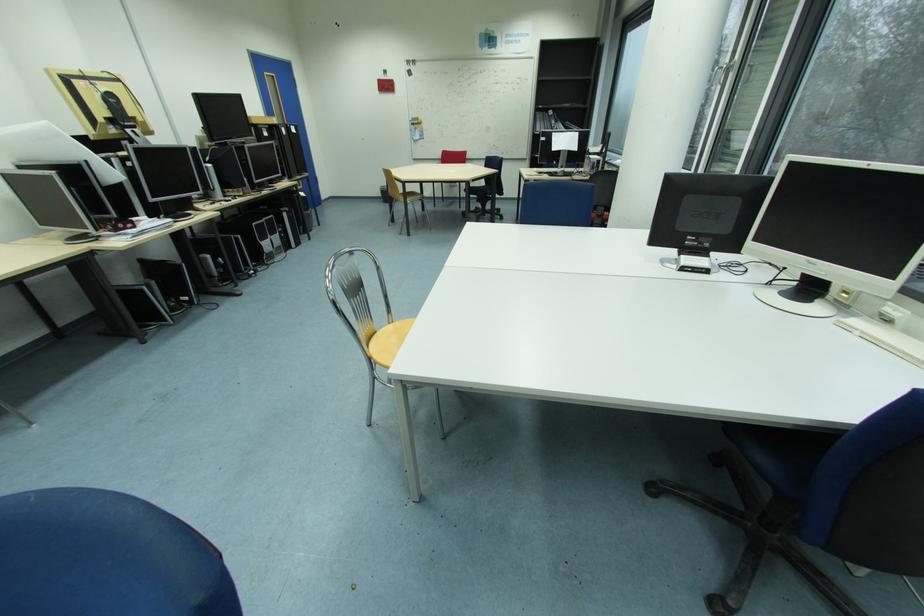
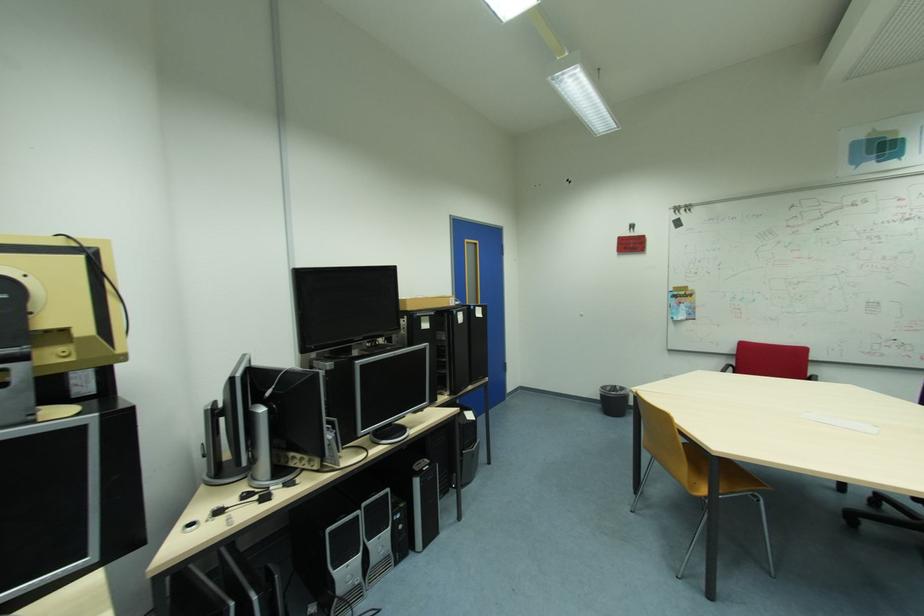
In the second image, find the point that corresponds to (x=274, y=135) in the first image.

(432, 326)